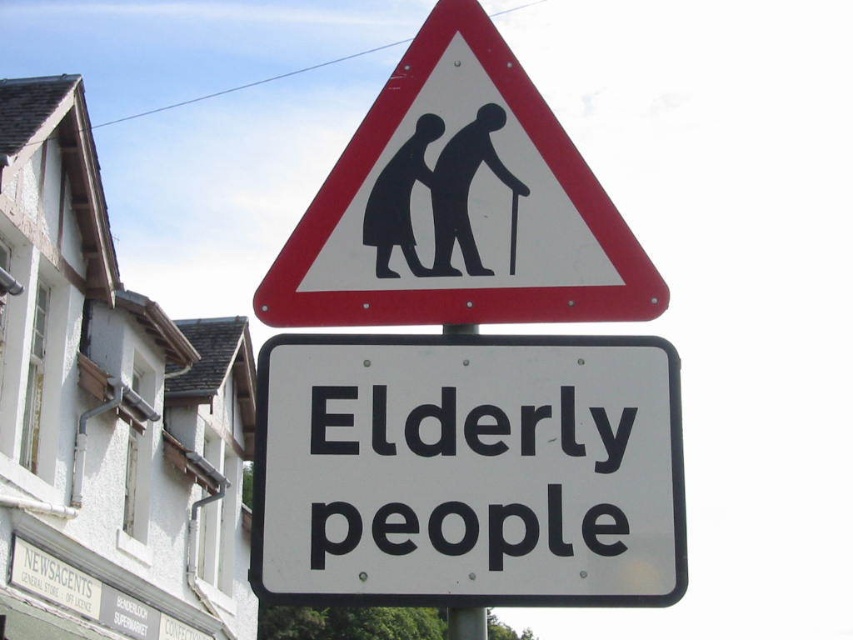
You are driving and see the road sign ahead. The white plastic sign at center and the black plastic sign at upper center are part of the same structure. Which direction should you look first to ensure you notice both signs properly?

You should look at the black plastic sign at upper center first because it is positioned above the white plastic sign at center, so checking the upper sign first ensures you notice both signs properly.

You are a delivery driver approaching the road sign described in the scene. Your vehicle requires a minimum of 6 meters to safely stop. Based on the distance provided, can you safely stop before hitting the white plastic sign at center?

The distance between the white plastic sign at center and the camera is 5.90 meters. Since your vehicle needs at least 6 meters to stop, you do not have enough distance and cannot safely stop in time.